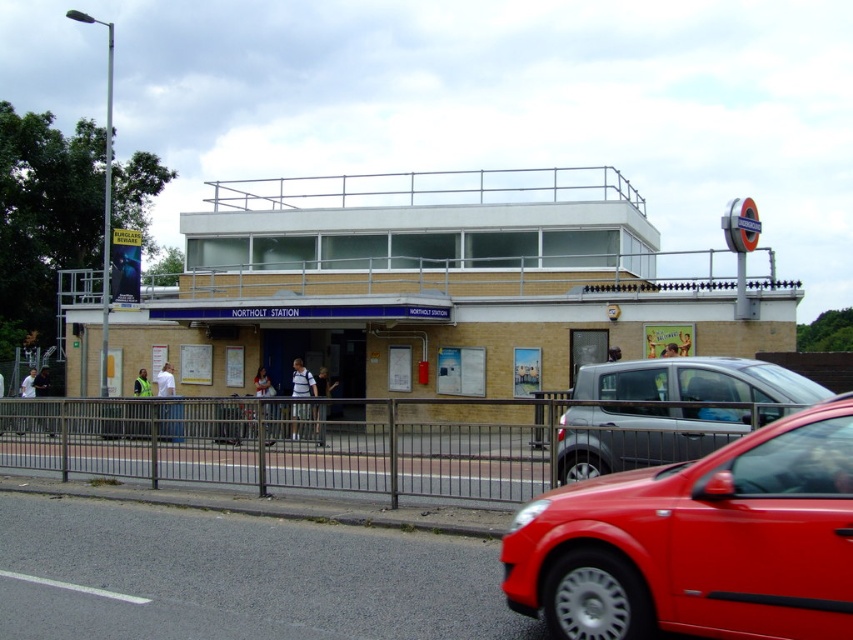
You are a delivery person who needs to park your shiny red car at lower right as close as possible to the station entrance. Based on the image, what is the closest parking spot available near the station entrance?

The closest parking spot available near the station entrance is at point (699, 541) where the shiny red car at lower right is currently positioned.

You are at Northolt Station and need to find the shiny red car at lower right. According to the scene description, where should you look relative to the station building?

The shiny red car at lower right is located at point coordinates (699,541), which places it near the lower right area relative to the station building.

You are a pedestrian standing at the entrance of Northolt Station and want to reach the silver metallic hatchback at right parked on the road. Which direction should you walk relative to the metallic gray fence at lower center?

You should walk to the right of the metallic gray fence at lower center to reach the silver metallic hatchback at right since the metallic gray fence at lower center is to the left of silver metallic hatchback at right.